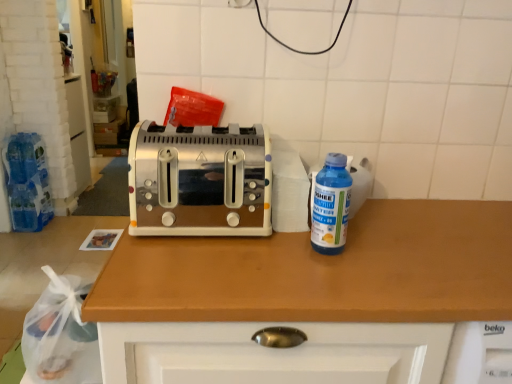
You are a GUI agent. You are given a task and a screenshot of the screen. Output one action in this format:
    pyautogui.click(x=<x>, y=<y>)
    Task: Click on the vacant area that lies to the right of blue plastic bottle at right
    
    Given the screenshot: What is the action you would take?
    pyautogui.click(x=388, y=253)